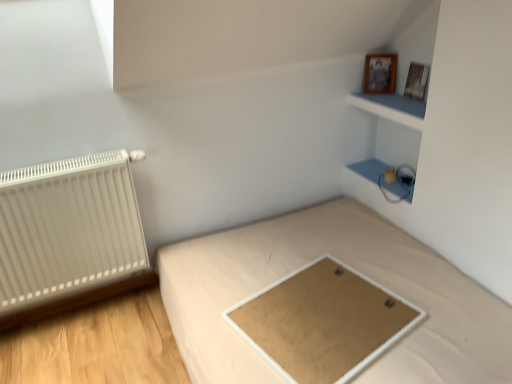
Find the location of `vacant area on top of white matte radiator at left (from a real-world perspective)`. vacant area on top of white matte radiator at left (from a real-world perspective) is located at coordinates (74, 160).